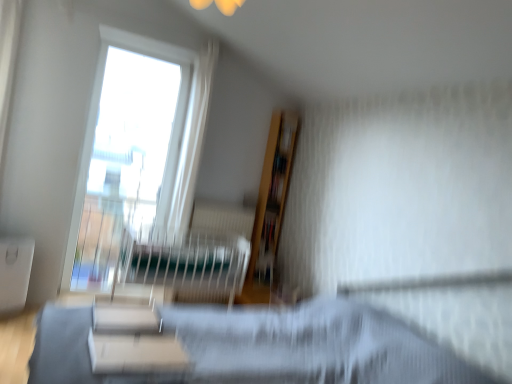
Question: Considering the relative sizes of white matte table at lower left, positioned as the 1th table in back-to-front order, and wooden bookshelf at upper center in the image provided, is white matte table at lower left, positioned as the 1th table in back-to-front order, taller than wooden bookshelf at upper center?

Choices:
 (A) no
 (B) yes

Answer: (B)

Question: Does white matte table at lower left, which is the first table in left-to-right order, turn towards wooden bookshelf at upper center?

Choices:
 (A) no
 (B) yes

Answer: (A)

Question: Considering the relative sizes of white matte table at lower left, the 2th table positioned from the front, and wooden bookshelf at upper center in the image provided, is white matte table at lower left, the 2th table positioned from the front, shorter than wooden bookshelf at upper center?

Choices:
 (A) yes
 (B) no

Answer: (B)

Question: Are white matte table at lower left, the 2th table positioned from the front, and wooden bookshelf at upper center beside each other?

Choices:
 (A) yes
 (B) no

Answer: (B)

Question: From a real-world perspective, is white matte table at lower left, the 2th table positioned from the front, below wooden bookshelf at upper center?

Choices:
 (A) no
 (B) yes

Answer: (B)

Question: Are white matte table at lower left, which is the first table in left-to-right order, and wooden bookshelf at upper center far apart?

Choices:
 (A) yes
 (B) no

Answer: (A)

Question: Is matte black hospital bed at center looking in the opposite direction of wooden bookshelf at upper center?

Choices:
 (A) no
 (B) yes

Answer: (A)

Question: Is matte black hospital bed at center shorter than wooden bookshelf at upper center?

Choices:
 (A) yes
 (B) no

Answer: (B)

Question: Could you tell me if matte black hospital bed at center is facing wooden bookshelf at upper center?

Choices:
 (A) yes
 (B) no

Answer: (B)

Question: From a real-world perspective, is matte black hospital bed at center located beneath wooden bookshelf at upper center?

Choices:
 (A) no
 (B) yes

Answer: (B)

Question: From the image's perspective, is matte black hospital bed at center under wooden bookshelf at upper center?

Choices:
 (A) yes
 (B) no

Answer: (A)

Question: Is matte black hospital bed at center positioned in front of wooden bookshelf at upper center?

Choices:
 (A) yes
 (B) no

Answer: (A)

Question: Considering the relative positions of wooden bookshelf at upper center and white matte table at lower center, which is counted as the 2th table, starting from the left, in the image provided, is wooden bookshelf at upper center to the right of white matte table at lower center, which is counted as the 2th table, starting from the left, from the viewer's perspective?

Choices:
 (A) yes
 (B) no

Answer: (A)